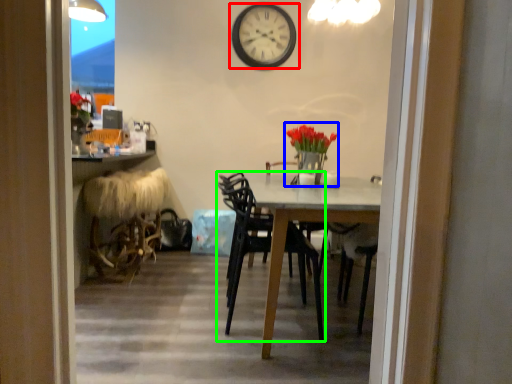
Question: Based on their relative distances, which object is farther from wall clock (highlighted by a red box)? Choose from floral arrangement (highlighted by a blue box) and chair (highlighted by a green box).

Choices:
 (A) floral arrangement
 (B) chair

Answer: (B)